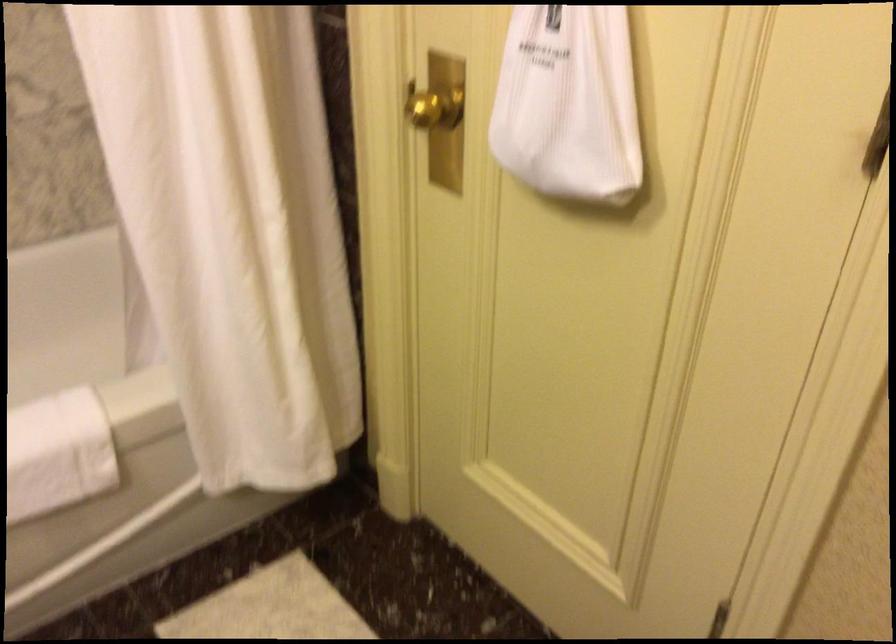
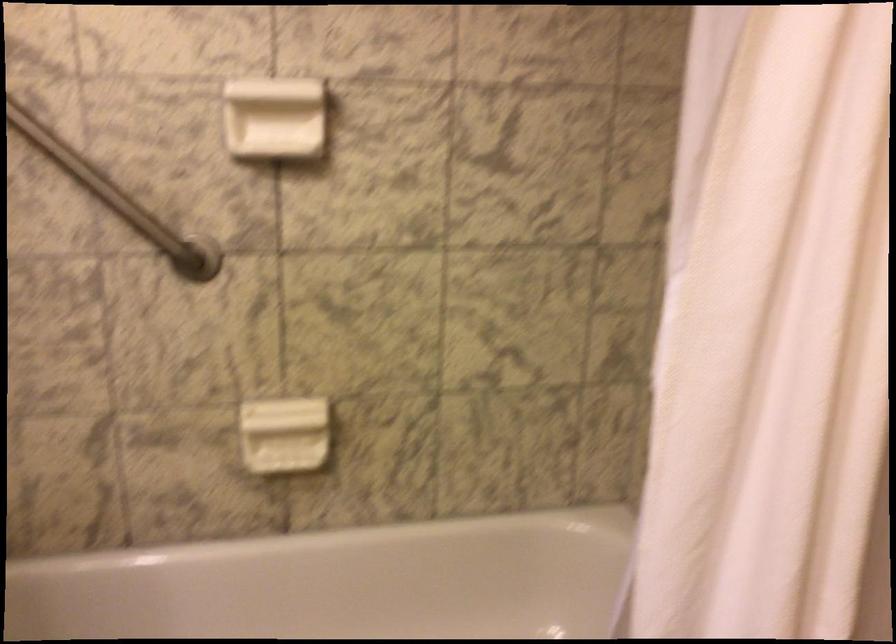
Question: The first image is from the beginning of the video and the second image is from the end. How did the camera likely rotate when shooting the video?

Choices:
 (A) Left
 (B) Right
 (C) Up
 (D) Down

Answer: (A)